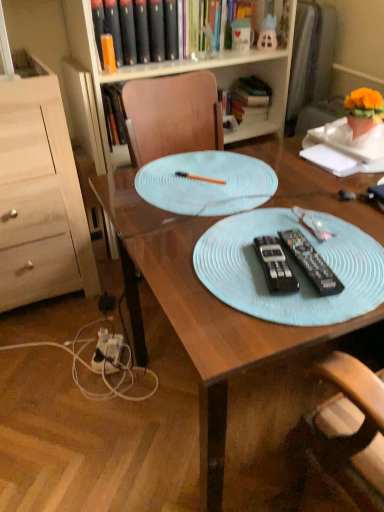
The image size is (384, 512). I want to click on vacant area located to the right-hand side of black plastic remote control at center, the 1th remote control when ordered from right to left, so click(356, 256).